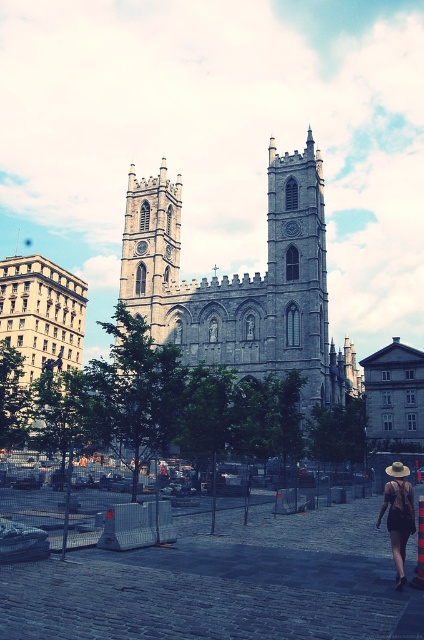
Who is positioned more to the right, gray stone church at center or matte black dress at lower right?

Positioned to the right is matte black dress at lower right.

This screenshot has height=640, width=424. In order to click on gray stone church at center in this screenshot , I will do `click(243, 284)`.

Identify the location of gray stone church at center. This screenshot has width=424, height=640. (243, 284).

Which of these two, gray stone church at center or gray stone church at left, stands taller?

Result: gray stone church at center is taller.

Which is in front, point (253, 360) or point (28, 296)?

Point (253, 360) is in front.

Which is behind, point (278, 352) or point (36, 289)?

The point (36, 289) is behind.

At what (x,y) coordinates should I click in order to perform the action: click on gray stone church at center. Please return your answer as a coordinate pair (x, y). This screenshot has height=640, width=424. Looking at the image, I should click on (243, 284).

Is gray stone church at left closer to camera compared to matte black dress at lower right?

No, it is behind matte black dress at lower right.

Who is more distant from viewer, [31,307] or [398,476]?

Point [31,307]

Find the location of a particular element. gray stone church at left is located at coordinates (35, 332).